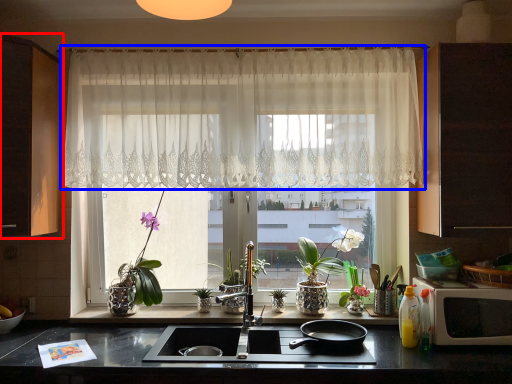
Question: Which point is further to the camera, cabinetry (highlighted by a red box) or curtain (highlighted by a blue box)?

Choices:
 (A) cabinetry
 (B) curtain

Answer: (B)